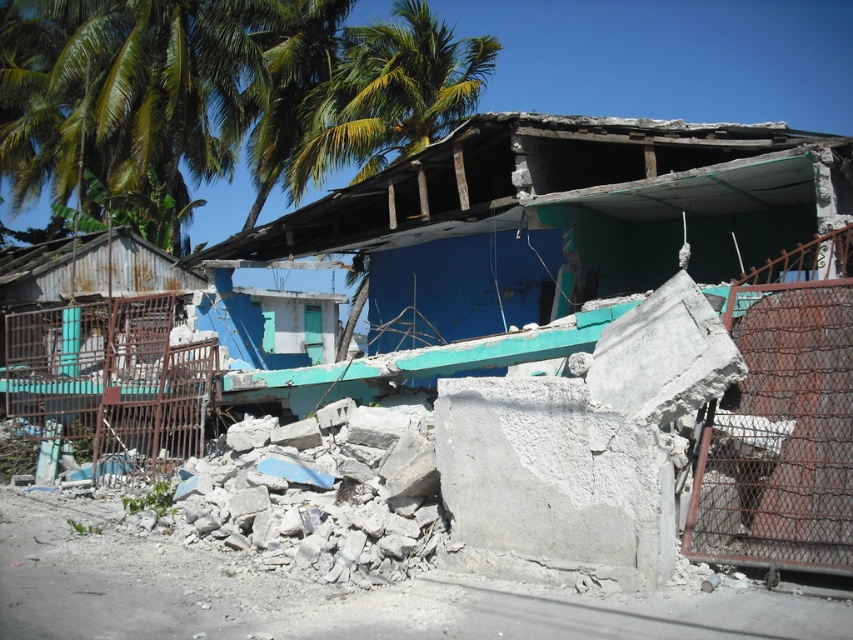
Does blue concrete hut at center have a lesser width compared to rusty metal fence at left?

In fact, blue concrete hut at center might be wider than rusty metal fence at left.

Does blue concrete hut at center have a larger size compared to rusty metal fence at left?

Correct, blue concrete hut at center is larger in size than rusty metal fence at left.

Between point (408, 252) and point (103, 460), which one is positioned in front?

Positioned in front is point (103, 460).

Identify the location of blue concrete hut at center. (556, 216).

Between point (502, 324) and point (323, 157), which one is positioned behind?

The point (323, 157) is more distant.

Image resolution: width=853 pixels, height=640 pixels. What do you see at coordinates (556, 216) in the screenshot?
I see `blue concrete hut at center` at bounding box center [556, 216].

Locate an element on the screen. blue concrete hut at center is located at coordinates (556, 216).

Where is `blue concrete hut at center`? The image size is (853, 640). blue concrete hut at center is located at coordinates (556, 216).

Can you confirm if rusty metal fence at left is positioned to the left of green leafy palm tree at upper center?

Indeed, rusty metal fence at left is positioned on the left side of green leafy palm tree at upper center.

Does rusty metal fence at left lie in front of green leafy palm tree at upper center?

Yes, it is.

This screenshot has width=853, height=640. In order to click on rusty metal fence at left in this screenshot , I will do `click(109, 381)`.